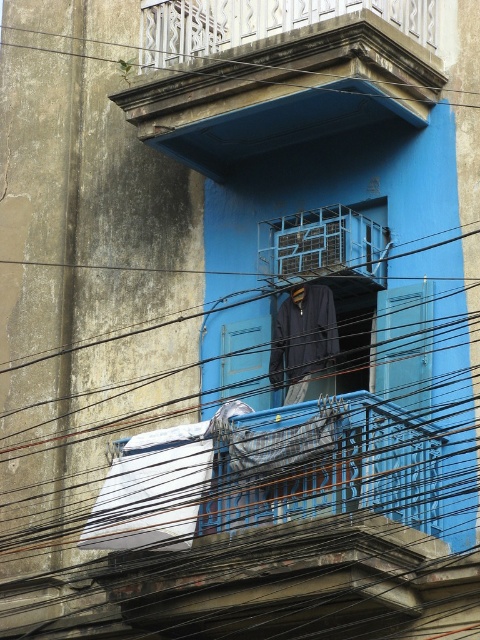
Where is `blue metal railing at upper center`? blue metal railing at upper center is located at coordinates (323, 246).

Based on the photo, which is more to the right, blue metal railing at upper center or dark blue fabric at center?

Positioned to the right is blue metal railing at upper center.

Is point (340, 204) farther from viewer compared to point (311, 330)?

Yes.

This screenshot has width=480, height=640. I want to click on blue metal railing at upper center, so click(x=323, y=246).

Which is below, blue metal railing at upper center or black wire at upper center?

blue metal railing at upper center is lower down.

Does blue metal railing at upper center appear on the right side of black wire at upper center?

Yes, blue metal railing at upper center is to the right of black wire at upper center.

Is point (350, 230) positioned after point (472, 93)?

No, it is not.

Where is `blue metal railing at upper center`? The width and height of the screenshot is (480, 640). blue metal railing at upper center is located at coordinates (323, 246).

Does dark blue fabric at center appear on the right side of black wire at upper center?

Yes, dark blue fabric at center is to the right of black wire at upper center.

Does dark blue fabric at center come behind black wire at upper center?

No, it is in front of black wire at upper center.

Image resolution: width=480 pixels, height=640 pixels. What do you see at coordinates (302, 339) in the screenshot?
I see `dark blue fabric at center` at bounding box center [302, 339].

Locate an element on the screen. dark blue fabric at center is located at coordinates (302, 339).